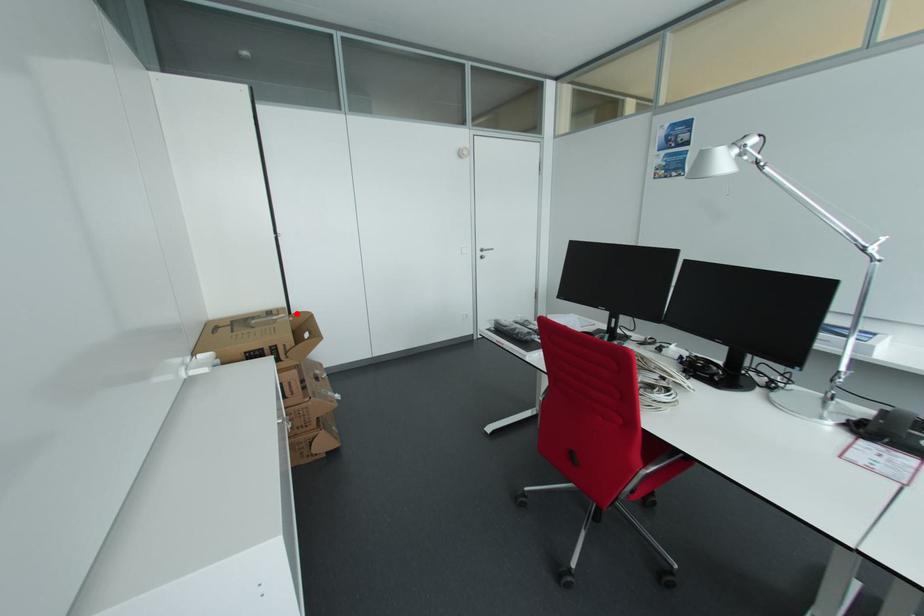
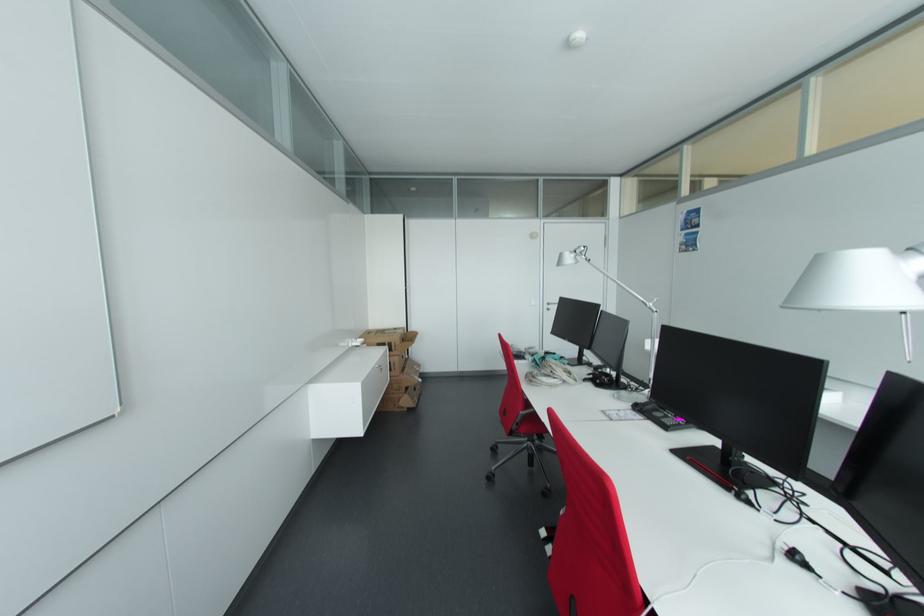
The point at the highlighted location is marked in the first image. Where is the corresponding point in the second image?

(412, 331)